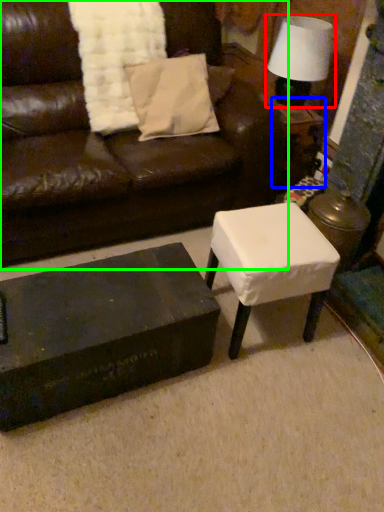
Question: Which is nearer to the table lamp (highlighted by a red box)? side table (highlighted by a blue box) or studio couch (highlighted by a green box).

Choices:
 (A) side table
 (B) studio couch

Answer: (A)